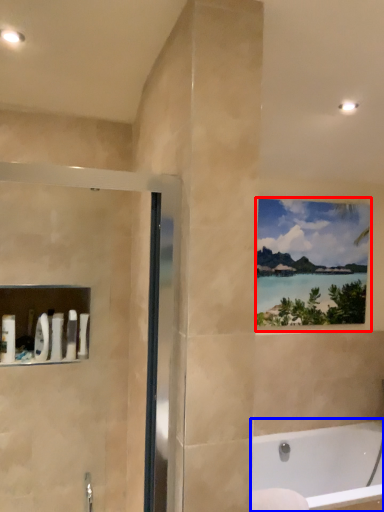
Question: Which point is further to the camera, window (highlighted by a red box) or bathtub (highlighted by a blue box)?

Choices:
 (A) window
 (B) bathtub

Answer: (A)